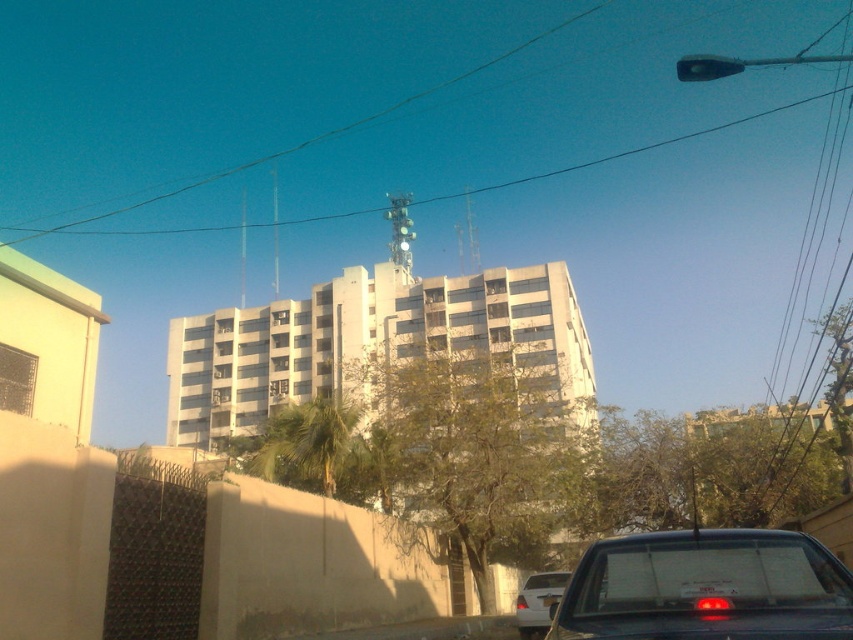
Is metallic gray sedan at lower right to the right of transparent glass traffic light at center from the viewer's perspective?

Yes, metallic gray sedan at lower right is to the right of transparent glass traffic light at center.

What do you see at coordinates (706, 580) in the screenshot? The width and height of the screenshot is (853, 640). I see `metallic gray sedan at lower right` at bounding box center [706, 580].

I want to click on metallic gray sedan at lower right, so click(706, 580).

Who is more distant from viewer, (396, 241) or (711, 595)?

Positioned behind is point (396, 241).

Who is more forward, [387,214] or [699,584]?

Point [699,584]

The height and width of the screenshot is (640, 853). I want to click on transparent glass traffic light at center, so click(399, 228).

Is black wire at upper center wider than white plastic license plate at center?

Yes.

Does black wire at upper center have a lesser width compared to white plastic license plate at center?

In fact, black wire at upper center might be wider than white plastic license plate at center.

Where is `black wire at upper center`? The image size is (853, 640). black wire at upper center is located at coordinates (317, 134).

Identify the location of black wire at upper center. This screenshot has height=640, width=853. (317, 134).